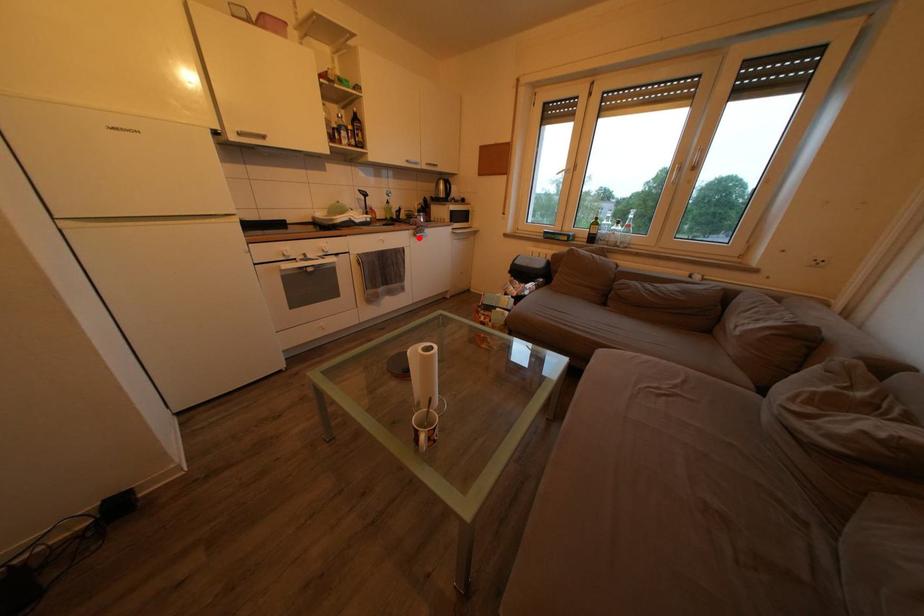
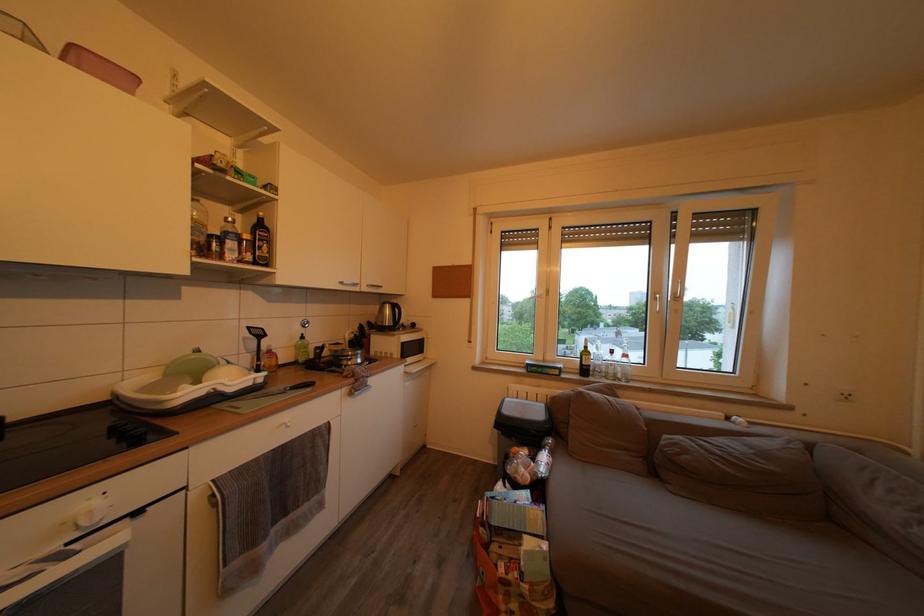
In the second image, find the point that corresponds to the highlighted location in the first image.

(351, 395)